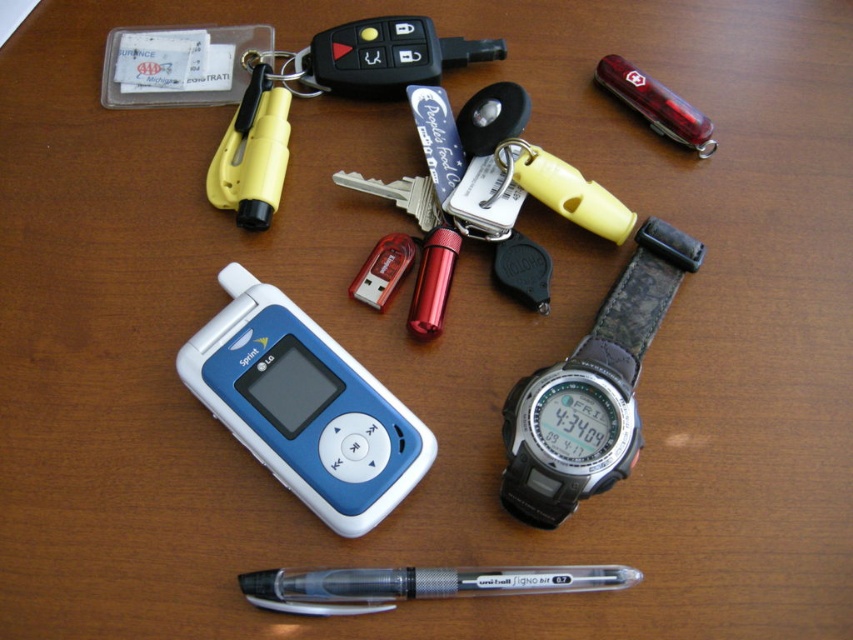
Does blue plastic phone at center lie behind black rubber watch at center-right?

Yes, blue plastic phone at center is further from the viewer.

Does blue plastic phone at center have a larger size compared to black rubber watch at center-right?

Incorrect, blue plastic phone at center is not larger than black rubber watch at center-right.

Does point (332, 528) come behind point (547, 436)?

Yes, point (332, 528) is farther from viewer.

Locate an element on the screen. The width and height of the screenshot is (853, 640). blue plastic phone at center is located at coordinates (305, 406).

Can you confirm if black rubber watch at center-right is positioned to the left of transparent plastic pen at lower center?

No, black rubber watch at center-right is not to the left of transparent plastic pen at lower center.

Identify the location of black rubber watch at center-right. The height and width of the screenshot is (640, 853). (590, 390).

How distant is blue plastic phone at center from transparent plastic pen at lower center?

blue plastic phone at center and transparent plastic pen at lower center are 7.82 inches apart.

Is point (398, 493) farther from camera compared to point (358, 602)?

Yes.

Who is more distant from viewer, (314, 484) or (614, 568)?

Point (314, 484)

Identify the location of blue plastic phone at center. The image size is (853, 640). (305, 406).